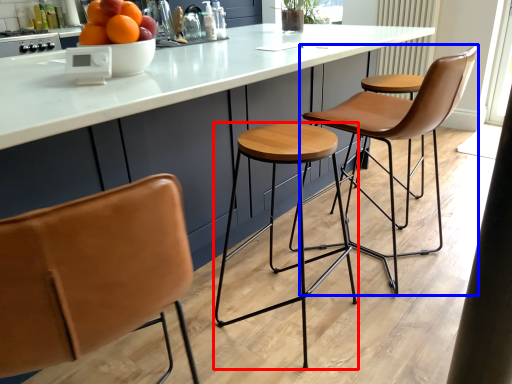
Question: Among these objects, which one is farthest to the camera, stool (highlighted by a red box) or chair (highlighted by a blue box)?

Choices:
 (A) stool
 (B) chair

Answer: (B)